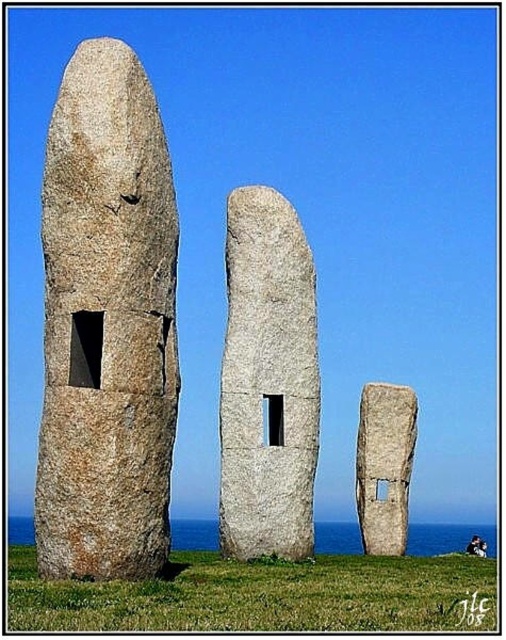
Question: Which of the following is the farthest from the observer?

Choices:
 (A) (284, 349)
 (B) (389, 460)

Answer: (B)

Question: In this image, where is granite stone at left located relative to smooth gray stone at center?

Choices:
 (A) right
 (B) left

Answer: (B)

Question: Does granite stone at left have a lesser width compared to smooth gray stone at center?

Choices:
 (A) no
 (B) yes

Answer: (A)

Question: Considering the real-world distances, which object is farthest from the granite stone at left?

Choices:
 (A) gray stone monolith at center
 (B) smooth gray stone at center

Answer: (B)

Question: Among these objects, which one is farthest from the camera?

Choices:
 (A) smooth gray stone at center
 (B) granite stone at left
 (C) gray stone monolith at center

Answer: (A)

Question: Does gray stone monolith at center appear over smooth gray stone at center?

Choices:
 (A) yes
 (B) no

Answer: (A)